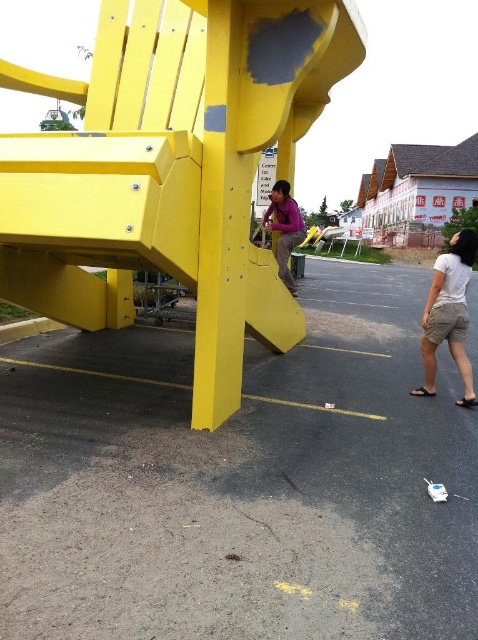
Between yellow matte bench at lower left and white cotton shirt at lower right, which one has more height?

With more height is white cotton shirt at lower right.

From the picture: Which is more to the right, yellow matte bench at lower left or white cotton shirt at lower right?

white cotton shirt at lower right is more to the right.

Consider the image. Who is more distant from viewer, (231,506) or (459,288)?

Positioned behind is point (459,288).

This screenshot has width=478, height=640. Find the location of `yellow matte bench at lower left`. yellow matte bench at lower left is located at coordinates (240, 483).

Can you confirm if yellow matte bench at lower left is shorter than purple matte shirt at center?

Yes, yellow matte bench at lower left is shorter than purple matte shirt at center.

Based on the photo, who is lower down, yellow matte bench at lower left or purple matte shirt at center?

yellow matte bench at lower left is below.

Describe the element at coordinates (240, 483) in the screenshot. I see `yellow matte bench at lower left` at that location.

At what (x,y) coordinates should I click in order to perform the action: click on yellow matte bench at lower left. Please return your answer as a coordinate pair (x, y). The image size is (478, 640). Looking at the image, I should click on coord(240,483).

In the scene shown: Can you confirm if white cotton shirt at lower right is smaller than purple matte shirt at center?

No, white cotton shirt at lower right is not smaller than purple matte shirt at center.

You are a GUI agent. You are given a task and a screenshot of the screen. Output one action in this format:
    pyautogui.click(x=<x>, y=<y>)
    Task: Click on the white cotton shirt at lower right
    
    Given the screenshot: What is the action you would take?
    pyautogui.click(x=448, y=314)

Does point (433, 308) come in front of point (300, 220)?

Yes, point (433, 308) is in front of point (300, 220).

Where is `white cotton shirt at lower right`? The image size is (478, 640). white cotton shirt at lower right is located at coordinates (448, 314).